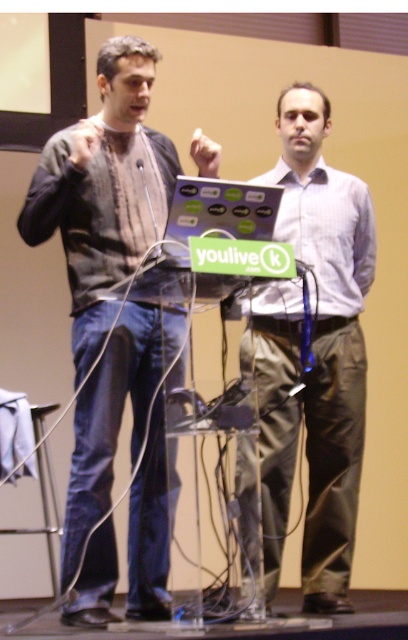
Based on the photo, you are a photographer setting up for an event. You have a camera with a 30cm wide lens. You need to capture both the white glossy shirt at center and the matte black laptop at center in the same frame. Can the camera lens accommodate both objects if they are positioned side by side?

The white glossy shirt at center might be wider than matte black laptop at center. Since the total width of both objects could exceed 30cm, it is uncertain if the camera lens can accommodate both in the same frame without further information on their exact widths.

You are attending a presentation and notice the speaker wearing a matte gray sweater at left and a matte black laptop at center on the podium. Which object is taller between the two?

The matte gray sweater at left is taller than the matte black laptop at center.